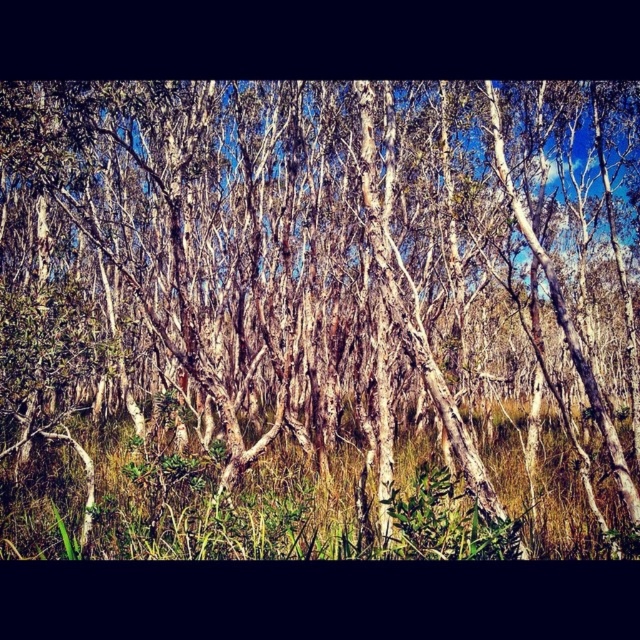
Question: Which object appears farthest from the camera in this image?

Choices:
 (A) green grass at lower center
 (B) white bark trees at center

Answer: (B)

Question: Which object appears closest to the camera in this image?

Choices:
 (A) white bark trees at center
 (B) green grass at lower center

Answer: (B)

Question: Does white bark trees at center appear on the left side of green grass at lower center?

Choices:
 (A) yes
 (B) no

Answer: (B)

Question: Does white bark trees at center appear under green grass at lower center?

Choices:
 (A) yes
 (B) no

Answer: (B)

Question: In this image, where is white bark trees at center located relative to green grass at lower center?

Choices:
 (A) below
 (B) above

Answer: (B)